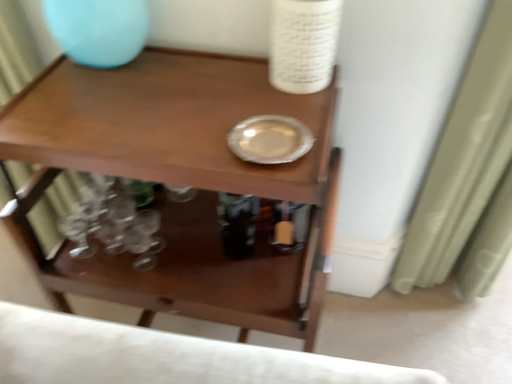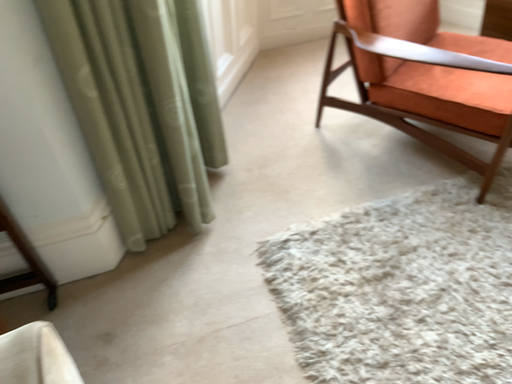
Question: Which way did the camera rotate in the video?

Choices:
 (A) rotated right
 (B) rotated left

Answer: (A)